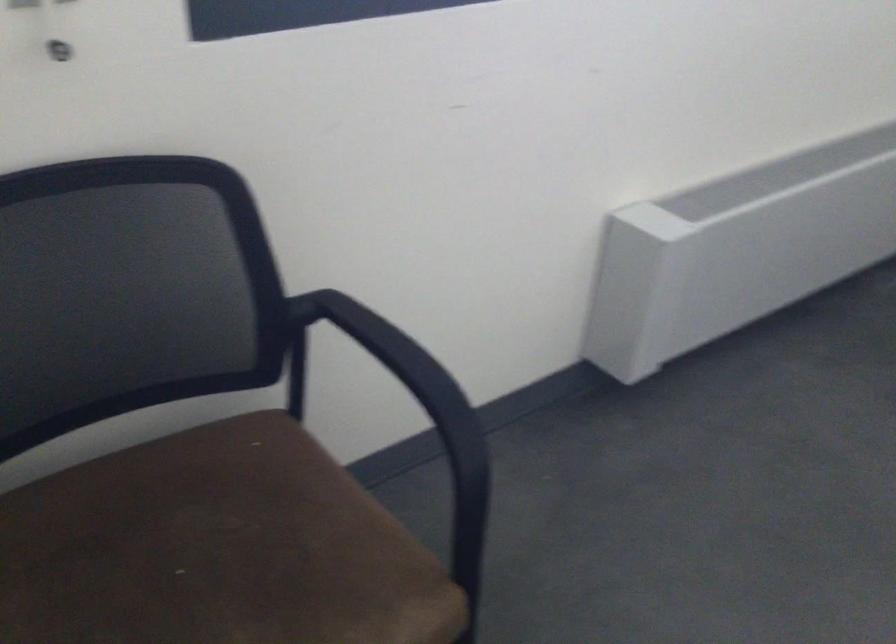
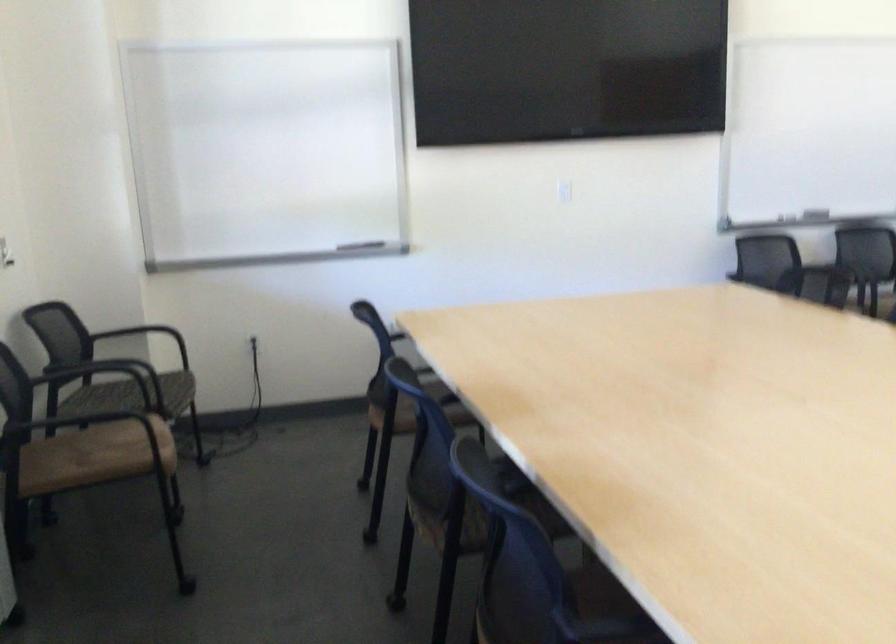
Question: How did the camera likely rotate?

Choices:
 (A) Left
 (B) Right
 (C) Up
 (D) Down

Answer: (B)